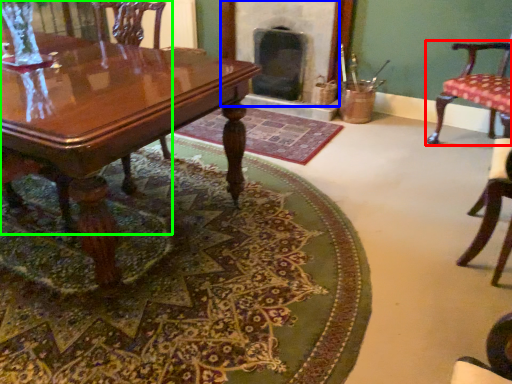
Question: Which object is the closest to the chair (highlighted by a red box)? Choose among these: fireplace (highlighted by a blue box) or chair (highlighted by a green box).

Choices:
 (A) fireplace
 (B) chair

Answer: (A)